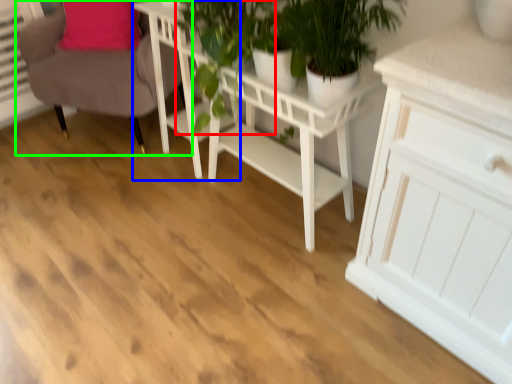
Question: Which object is positioned closest to plant (highlighted by a red box)? Select from table (highlighted by a blue box) and chair (highlighted by a green box).

Choices:
 (A) table
 (B) chair

Answer: (A)